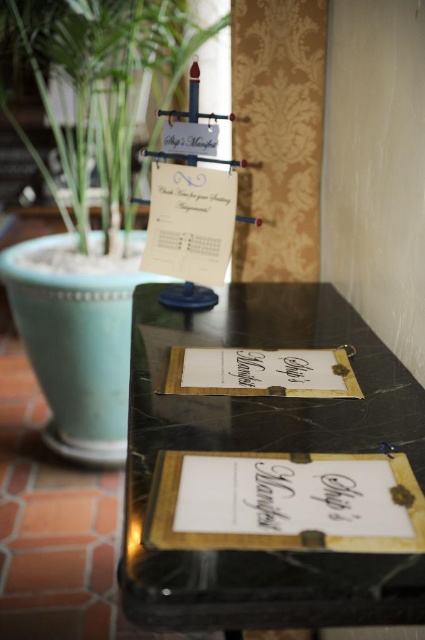
You are a delivery person who needs to place a small package on the black marble table at center without touching the gold paper at center. Is there enough space between them to safely place the package?

The black marble table at center is 14.90 centimeters away from gold paper at center. Since the distance is sufficient, you can safely place the package on the table without touching the gold paper at center.

You are standing in the scene and want to touch both the point at coordinates point (302, 556) and point (269, 376). Which point will you reach first?

You will reach point (302, 556) first because it is closer to you than point (269, 376).